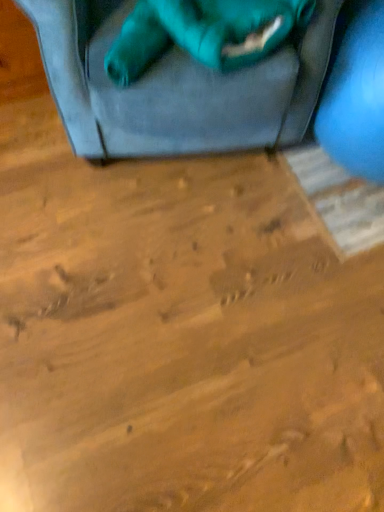
Question: From the image's perspective, is matte blue exercise ball at right on top of teal fabric cat at upper center?

Choices:
 (A) yes
 (B) no

Answer: (B)

Question: From a real-world perspective, is matte blue exercise ball at right physically above teal fabric cat at upper center?

Choices:
 (A) yes
 (B) no

Answer: (B)

Question: Is matte blue exercise ball at right shorter than teal fabric cat at upper center?

Choices:
 (A) yes
 (B) no

Answer: (B)

Question: Is matte blue exercise ball at right wider than teal fabric cat at upper center?

Choices:
 (A) yes
 (B) no

Answer: (A)

Question: From a real-world perspective, is matte blue exercise ball at right beneath teal fabric cat at upper center?

Choices:
 (A) yes
 (B) no

Answer: (A)

Question: Could teal fabric cat at upper center be considered to be inside matte blue exercise ball at right?

Choices:
 (A) yes
 (B) no

Answer: (B)

Question: From the image's perspective, does teal fabric cat at upper center appear lower than matte blue exercise ball at right?

Choices:
 (A) no
 (B) yes

Answer: (A)

Question: Considering the relative positions of teal fabric cat at upper center and matte blue exercise ball at right in the image provided, is teal fabric cat at upper center in front of matte blue exercise ball at right?

Choices:
 (A) yes
 (B) no

Answer: (B)

Question: From the image's perspective, would you say teal fabric cat at upper center is positioned over matte blue exercise ball at right?

Choices:
 (A) yes
 (B) no

Answer: (A)

Question: Is teal fabric cat at upper center positioned behind matte blue exercise ball at right?

Choices:
 (A) yes
 (B) no

Answer: (A)

Question: Is teal fabric cat at upper center with matte blue exercise ball at right?

Choices:
 (A) yes
 (B) no

Answer: (B)

Question: Can we say teal fabric cat at upper center lies outside matte blue exercise ball at right?

Choices:
 (A) yes
 (B) no

Answer: (A)

Question: From a real-world perspective, is matte blue exercise ball at right above or below teal fabric cat at upper center?

Choices:
 (A) below
 (B) above

Answer: (A)